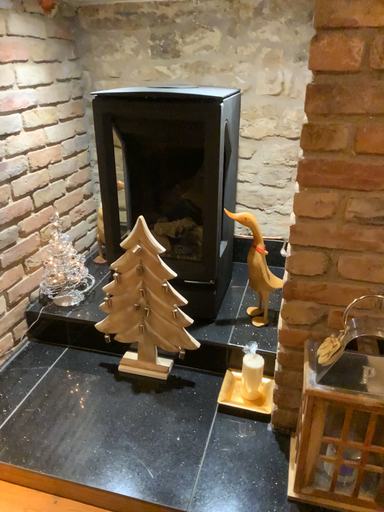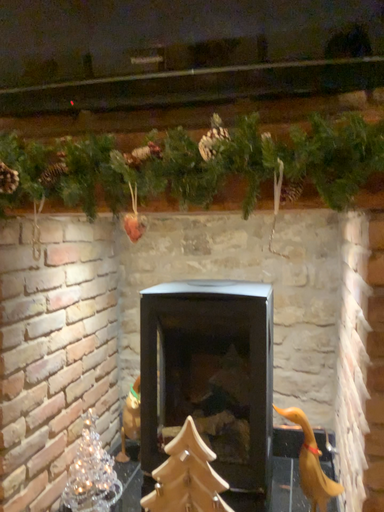
Question: Which way did the camera rotate in the video?

Choices:
 (A) rotated upward
 (B) rotated downward

Answer: (A)